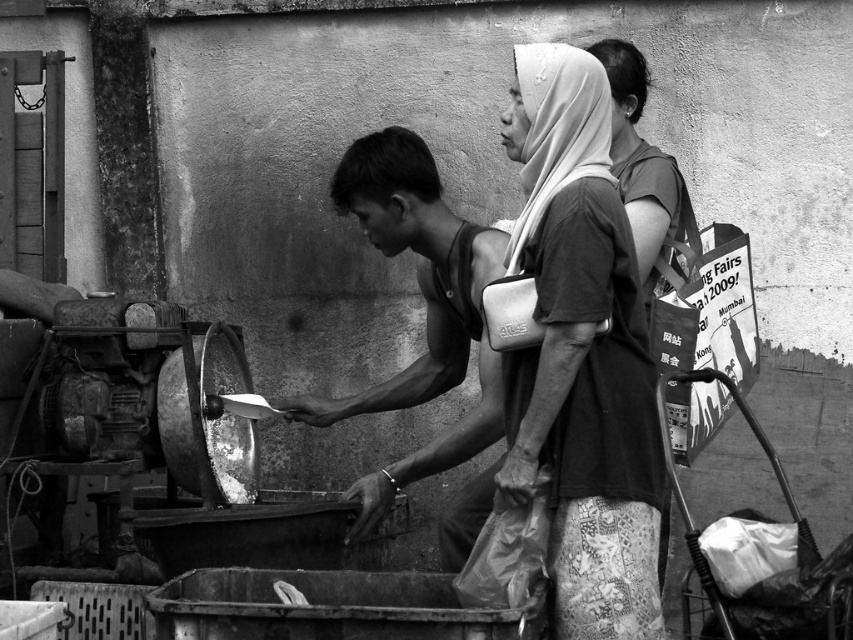
You are a photographer trying to take a clear photo of the matte black purse at center and the matte black headscarf at upper right. Which object will be more visible in the photo due to its position?

The matte black headscarf at upper right is behind the matte black purse at center, so the matte black purse at center will be more visible in the photo.

Based on the scene described, can you determine if the matte black headscarf at upper right is covering any part of the smooth skin man at center?

The matte black headscarf at upper right is positioned over the smooth skin man at center, so yes, it is covering part of him.

You are standing at the position of the viewer. There is a matte black headscarf at upper right. Can you reach it with your outstretched arm?

The distance between the matte black headscarf at upper right and the viewer is 3.40 meters, which is much farther than the typical human arm length, so you cannot reach it with your outstretched arm.